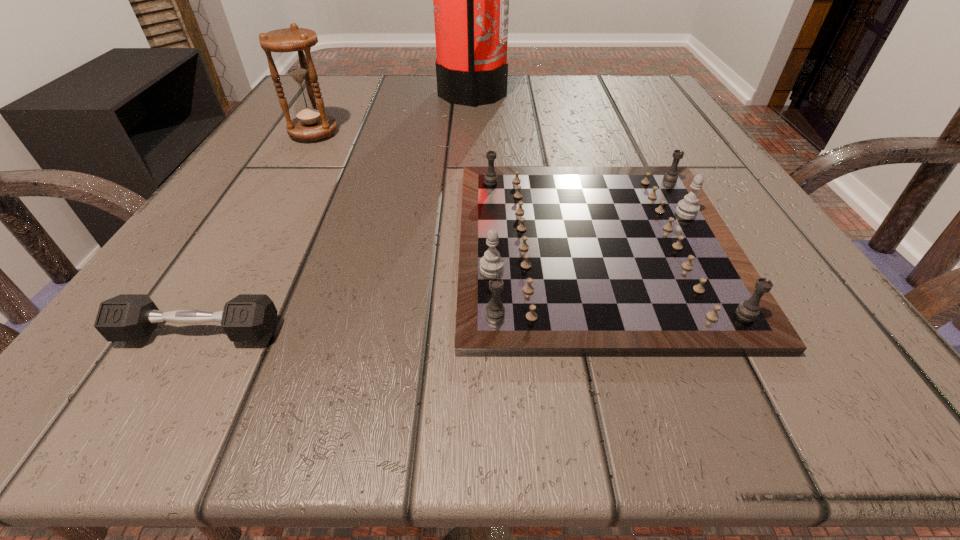
Locate an element on the screen. vacant space at the far edge of the desktop is located at coordinates (404, 122).

This screenshot has height=540, width=960. In the image, there is a desktop. In order to click on free space at the near edge in this screenshot , I will do `click(469, 363)`.

Find the location of a particular element. vacant point at the left edge is located at coordinates (236, 202).

In the image, there is a desktop. Where is `vacant space at the right edge`? This screenshot has height=540, width=960. vacant space at the right edge is located at coordinates pos(621,159).

In the image, there is a desktop. Identify the location of vacant space at the far left corner. The image size is (960, 540). (362, 114).

This screenshot has height=540, width=960. I want to click on free space at the near left corner of the desktop, so click(180, 355).

Identify the location of vacant space at the far right corner. Image resolution: width=960 pixels, height=540 pixels. (611, 73).

Find the location of a particular element. Image resolution: width=960 pixels, height=540 pixels. empty location between the farthest object and the third nearest object is located at coordinates pos(393,114).

Find the location of a particular element. vacant region between the second farthest object and the fire extinguisher is located at coordinates (393, 114).

Where is `vacant area between the third shortest object and the tallest object`? The height and width of the screenshot is (540, 960). vacant area between the third shortest object and the tallest object is located at coordinates (393, 114).